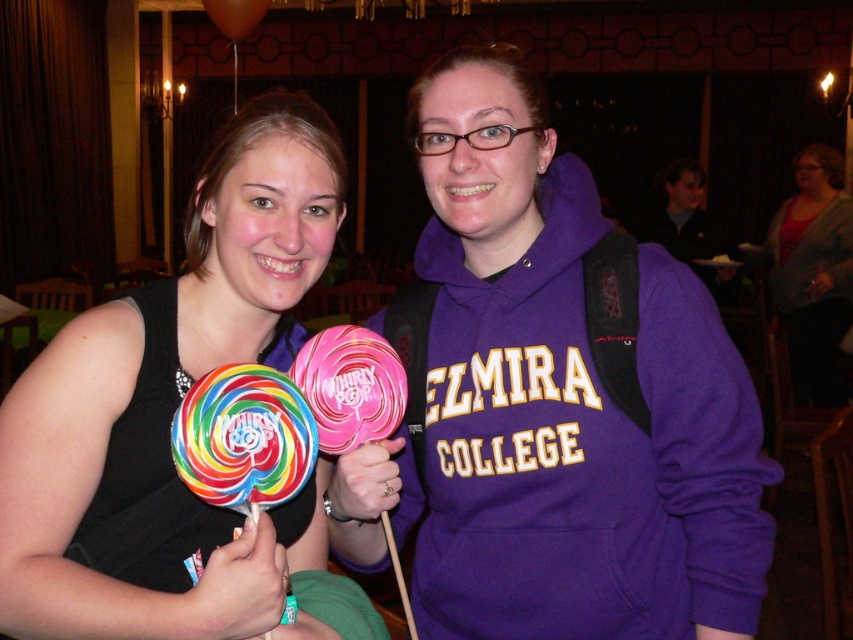
You are at a party and see the purple matte hoodie at center and the matte black dress at left. Which one is higher up in the image?

The purple matte hoodie at center is higher up than the matte black dress at left in the image.

You are standing in the same room as the two people. You want to hand a gift to the person wearing the matte black dress at left without disturbing the person holding the rainbow lollipop at center. Which direction should you approach from?

You should approach from the side of the matte black dress at left since it is closer to you than the rainbow lollipop at center, allowing you to reach them without getting too close to the other person.

Based on the scene description, where is the purple matte hoodie at center located in the image?

The purple matte hoodie at center is located at point (554, 401).